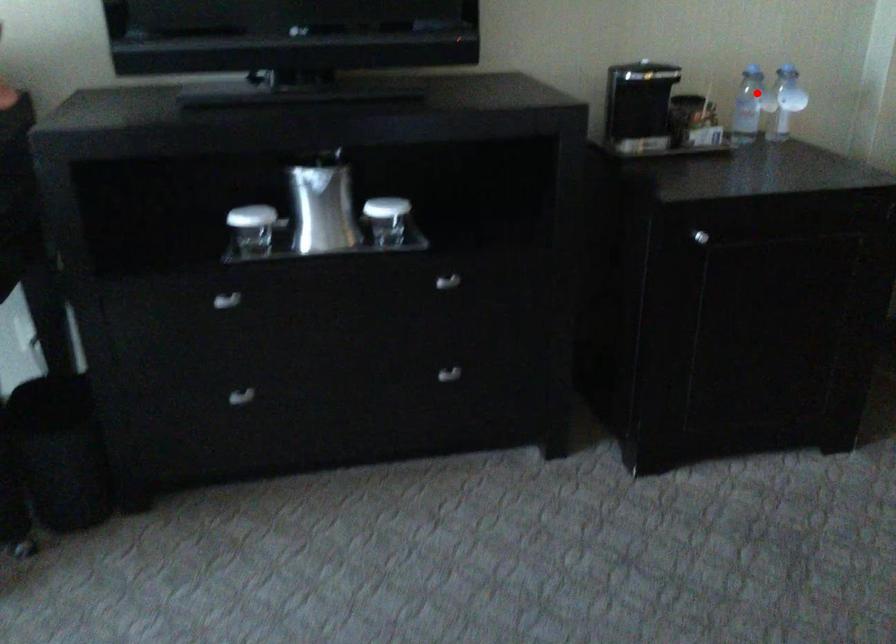
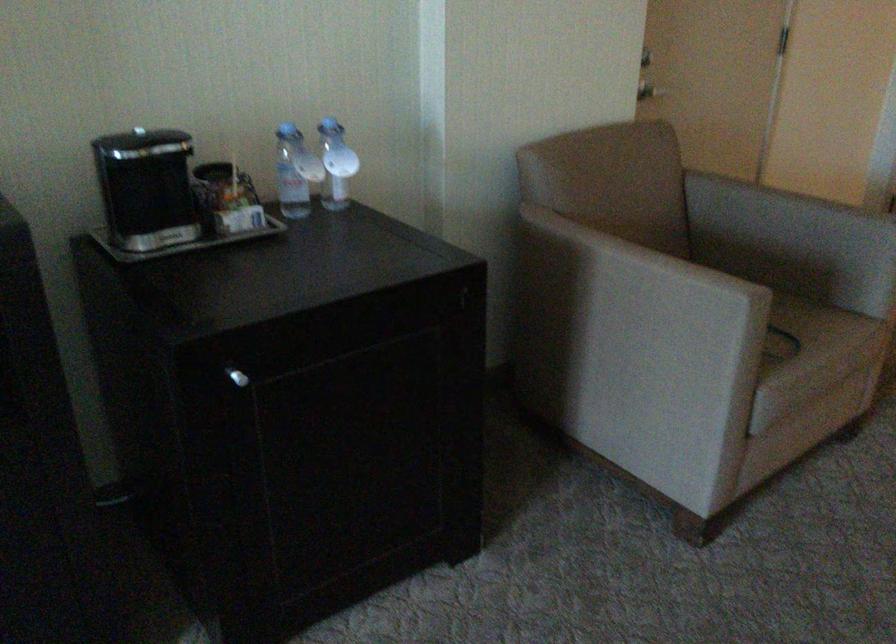
Question: I am providing you with two images of the same scene from different viewpoints. Image1 has a red point marked. In image2, the corresponding 3D location appears at what relative position? Reply with the corresponding letter.

Choices:
 (A) Closer
 (B) Farther

Answer: (A)